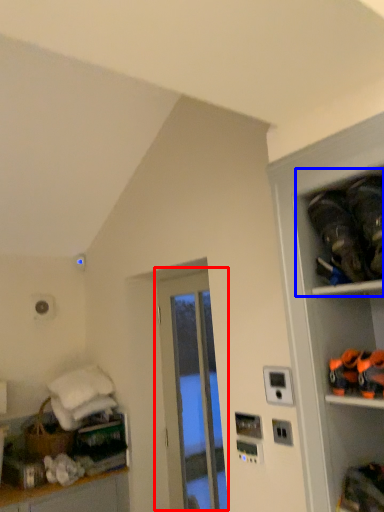
Question: Which point is closer to the camera, door (highlighted by a red box) or shelf (highlighted by a blue box)?

Choices:
 (A) door
 (B) shelf

Answer: (B)